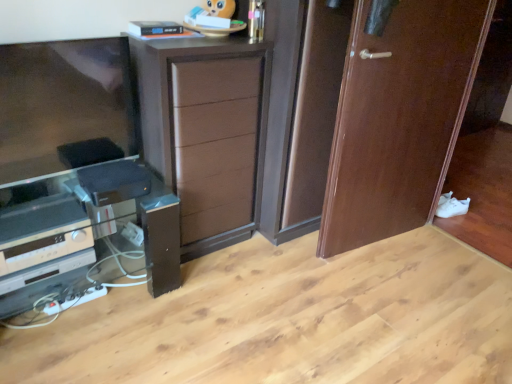
Where is `free space in front of brown wood chest of drawers at center`? free space in front of brown wood chest of drawers at center is located at coordinates (218, 293).